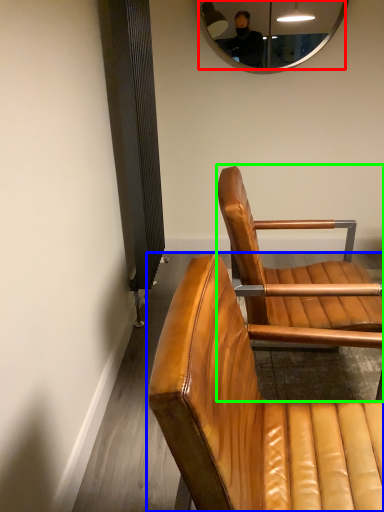
Question: Which object is the farthest from mirror (highlighted by a red box)? Choose among these: chair (highlighted by a blue box) or chair (highlighted by a green box).

Choices:
 (A) chair
 (B) chair

Answer: (A)